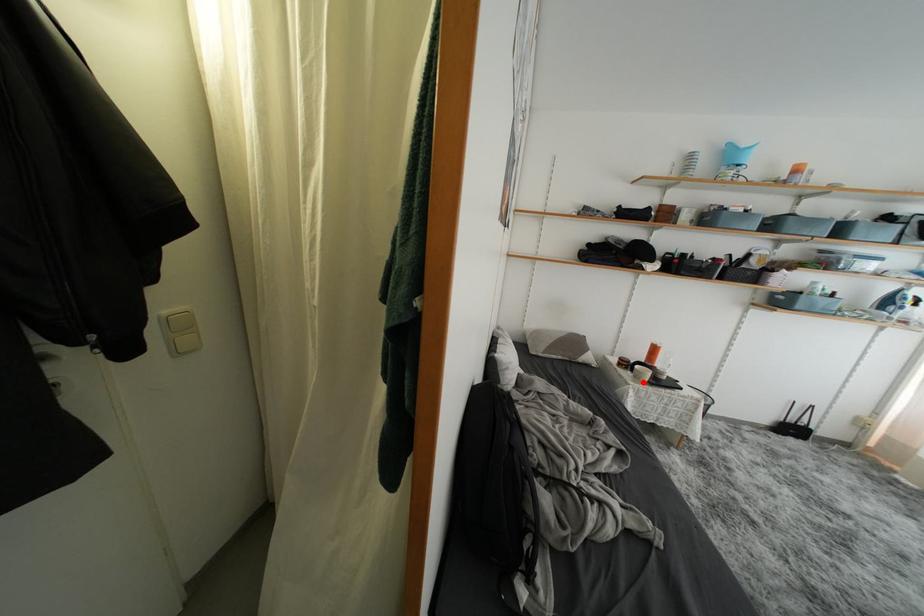
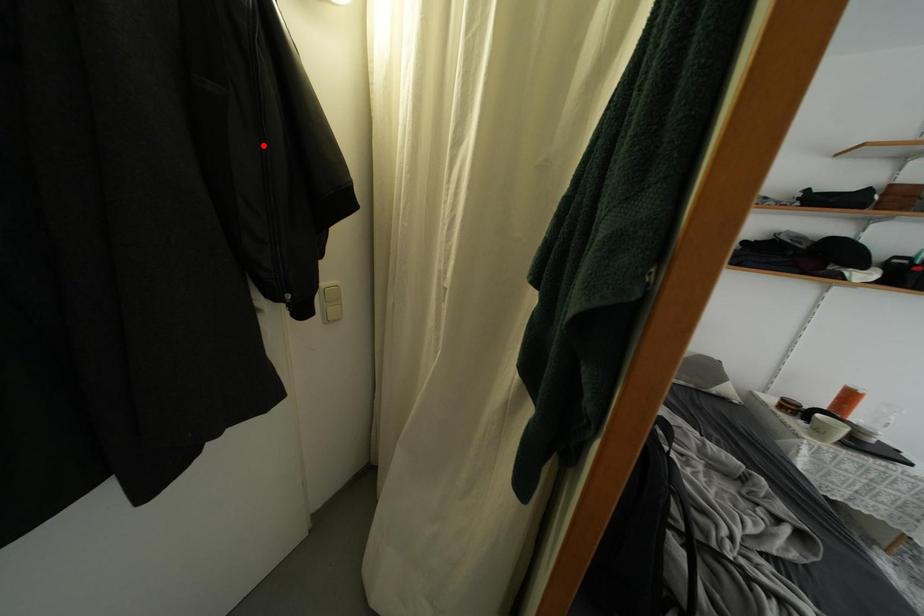
In the scene shown: I am providing you with two images of the same scene from different viewpoints. A red point is marked on the first image and another point is marked on the second image. Is the marked point in image1 the same physical position as the marked point in image2?

No